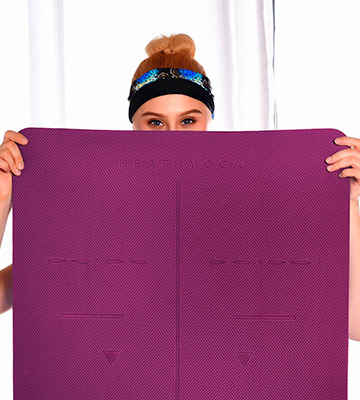
You are a GUI agent. You are given a task and a screenshot of the screen. Output one action in this format:
    pyautogui.click(x=<x>, y=<y>)
    Task: Click on the white curtain
    The width and height of the screenshot is (360, 400).
    Given the screenshot: What is the action you would take?
    pyautogui.click(x=237, y=30)